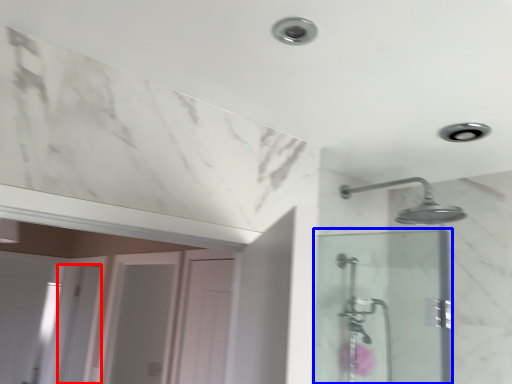
Question: Which object appears closest to the camera in this image, screen door (highlighted by a red box) or screen door (highlighted by a blue box)?

Choices:
 (A) screen door
 (B) screen door

Answer: (B)